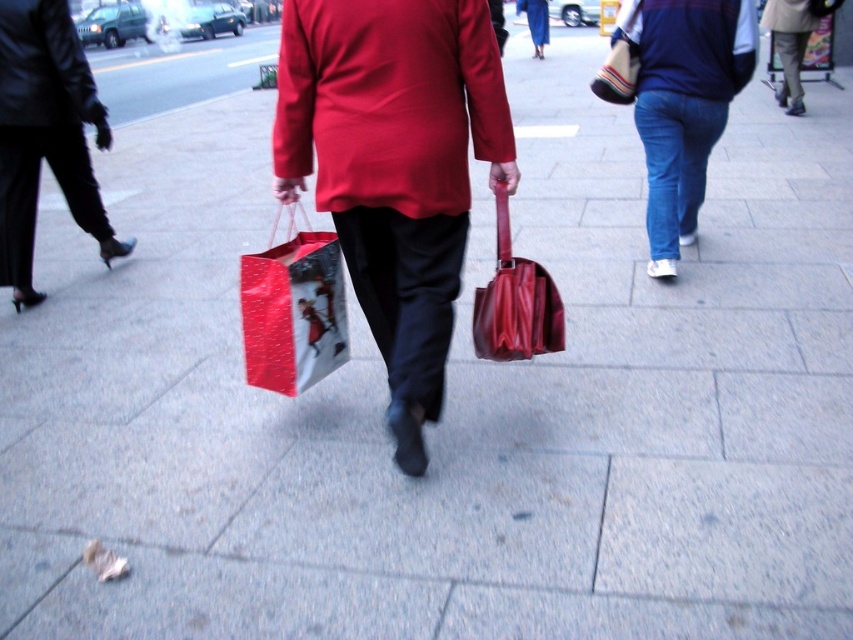
Who is taller, denim jeans at right or striped fabric bag at upper right?

denim jeans at right

Does denim jeans at right appear on the right side of striped fabric bag at upper right?

Correct, you'll find denim jeans at right to the right of striped fabric bag at upper right.

You are a GUI agent. You are given a task and a screenshot of the screen. Output one action in this format:
    pyautogui.click(x=<x>, y=<y>)
    Task: Click on the denim jeans at right
    The image size is (853, 640).
    Given the screenshot: What is the action you would take?
    pyautogui.click(x=683, y=104)

Is matte red jacket at center further to camera compared to striped fabric bag at upper right?

No, it is not.

Between matte red jacket at center and striped fabric bag at upper right, which one is positioned higher?

striped fabric bag at upper right is higher up.

Image resolution: width=853 pixels, height=640 pixels. I want to click on matte red jacket at center, so click(x=393, y=168).

Between point (271, 140) and point (631, 48), which one is positioned in front?

Positioned in front is point (631, 48).

Does point (431, 108) come closer to viewer compared to point (624, 77)?

Yes, point (431, 108) is closer to viewer.

Locate an element on the screen. matte red sweatshirt at center is located at coordinates (387, 100).